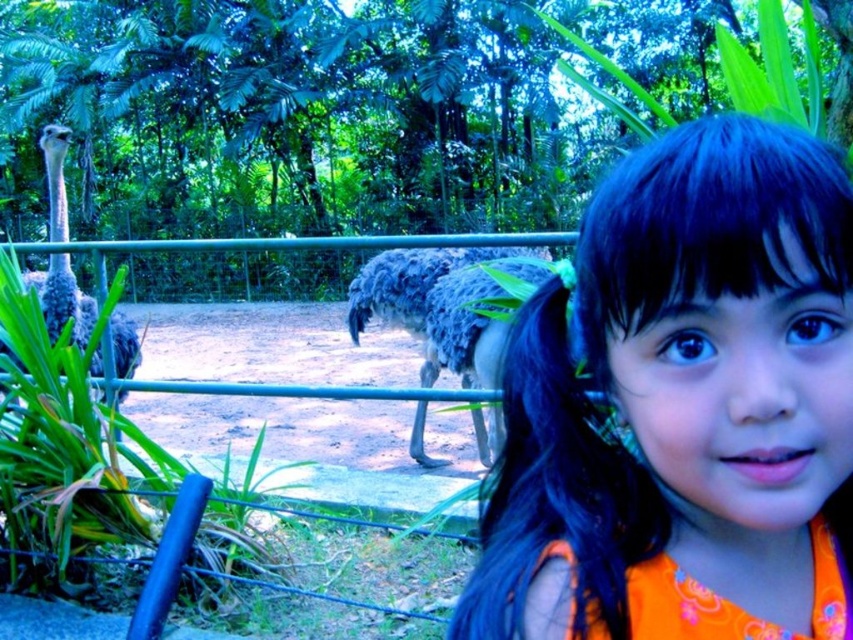
Does gray feathered ostrich at center have a smaller size compared to gray feathered ostrich at left?

Incorrect, gray feathered ostrich at center is not smaller in size than gray feathered ostrich at left.

Is the position of gray feathered ostrich at center more distant than that of gray feathered ostrich at left?

No.

Is point (357, 285) positioned behind point (55, 285)?

Yes, point (357, 285) is behind point (55, 285).

The image size is (853, 640). I want to click on gray feathered ostrich at center, so click(x=437, y=307).

Looking at this image, can you confirm if blue hair at upper right is thinner than gray feathered ostrich at left?

Yes, blue hair at upper right is thinner than gray feathered ostrich at left.

Is blue hair at upper right below gray feathered ostrich at left?

No, blue hair at upper right is not below gray feathered ostrich at left.

Which is behind, point (474, 616) or point (67, 204)?

The point (67, 204) is more distant.

You are a GUI agent. You are given a task and a screenshot of the screen. Output one action in this format:
    pyautogui.click(x=<x>, y=<y>)
    Task: Click on the blue hair at upper right
    
    Given the screenshot: What is the action you would take?
    pyautogui.click(x=683, y=406)

Is blue hair at upper right behind gray feathered ostrich at center?

No, blue hair at upper right is closer to the viewer.

Which is in front, point (814, 179) or point (427, 348)?

Positioned in front is point (814, 179).

Locate an element on the screen. The height and width of the screenshot is (640, 853). blue hair at upper right is located at coordinates 683,406.

This screenshot has height=640, width=853. What are the coordinates of `blue hair at upper right` in the screenshot? It's located at (683, 406).